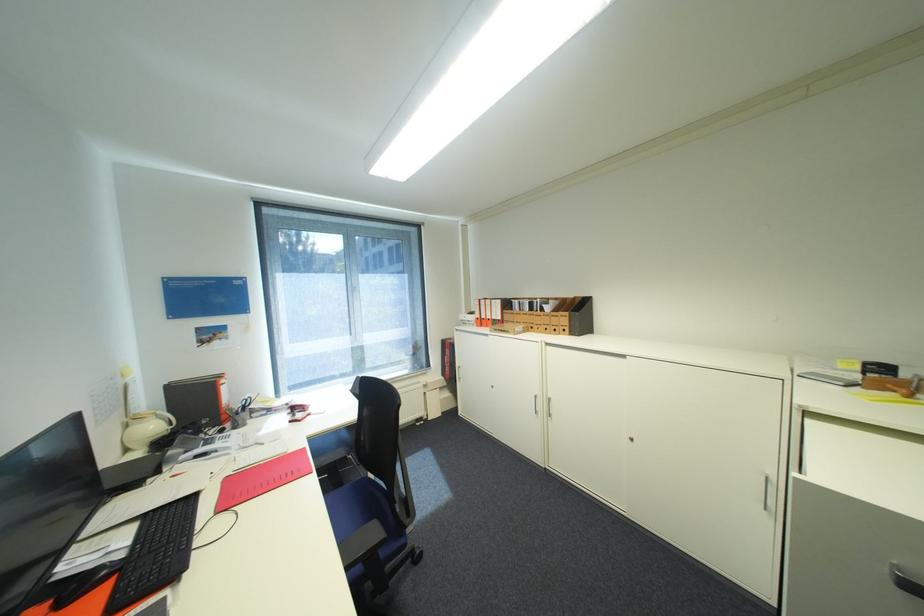
This screenshot has width=924, height=616. What do you see at coordinates (146, 429) in the screenshot?
I see `the telephone handset` at bounding box center [146, 429].